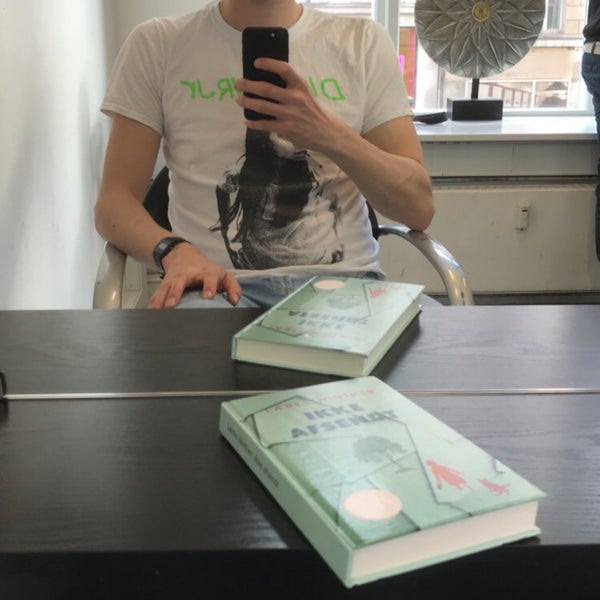
In order to click on window in this screenshot , I will do `click(561, 92)`, `click(567, 12)`, `click(522, 86)`, `click(424, 80)`.